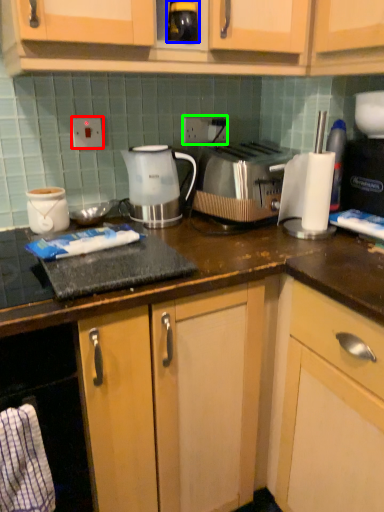
Question: Estimate the real-world distances between objects in this image. Which object is closer to electric outlet (highlighted by a red box), beverage (highlighted by a blue box) or electric outlet (highlighted by a green box)?

Choices:
 (A) beverage
 (B) electric outlet

Answer: (B)